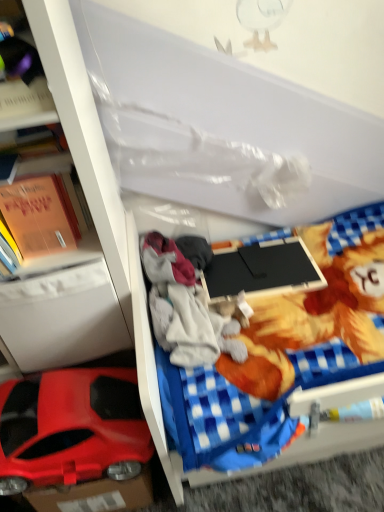
Question: Is black matte laptop at center next to orange paper book at left and touching it?

Choices:
 (A) yes
 (B) no

Answer: (B)

Question: From a real-world perspective, does black matte laptop at center sit lower than orange paper book at left?

Choices:
 (A) no
 (B) yes

Answer: (B)

Question: Does black matte laptop at center lie in front of orange paper book at left?

Choices:
 (A) yes
 (B) no

Answer: (B)

Question: Is black matte laptop at center taller than orange paper book at left?

Choices:
 (A) yes
 (B) no

Answer: (B)

Question: Does black matte laptop at center appear on the right side of orange paper book at left?

Choices:
 (A) yes
 (B) no

Answer: (A)

Question: Is blue checkered bed frame at center taller or shorter than orange paper book at left?

Choices:
 (A) tall
 (B) short

Answer: (A)

Question: Which is correct: blue checkered bed frame at center is inside orange paper book at left, or outside of it?

Choices:
 (A) inside
 (B) outside

Answer: (B)

Question: From a real-world perspective, is blue checkered bed frame at center physically located above or below orange paper book at left?

Choices:
 (A) below
 (B) above

Answer: (A)

Question: From the image's perspective, is blue checkered bed frame at center positioned above or below orange paper book at left?

Choices:
 (A) above
 (B) below

Answer: (B)

Question: Considering the relative positions of gray fleece hoodie at center and white plastic drawer at left in the image provided, is gray fleece hoodie at center to the left or to the right of white plastic drawer at left?

Choices:
 (A) left
 (B) right

Answer: (B)

Question: Is point (190, 269) closer or farther from the camera than point (66, 274)?

Choices:
 (A) farther
 (B) closer

Answer: (A)

Question: Looking at the image, does gray fleece hoodie at center seem bigger or smaller compared to white plastic drawer at left?

Choices:
 (A) big
 (B) small

Answer: (B)

Question: From their relative heights in the image, would you say gray fleece hoodie at center is taller or shorter than white plastic drawer at left?

Choices:
 (A) tall
 (B) short

Answer: (B)

Question: Does point (29, 407) appear closer or farther from the camera than point (62, 287)?

Choices:
 (A) farther
 (B) closer

Answer: (A)

Question: From a real-world perspective, is shiny plastic car at lower left above or below white plastic drawer at left?

Choices:
 (A) above
 (B) below

Answer: (B)